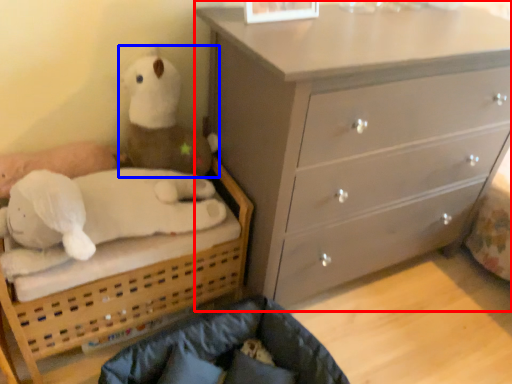
Question: Among these objects, which one is farthest to the camera, chest of drawers (highlighted by a red box) or toy (highlighted by a blue box)?

Choices:
 (A) chest of drawers
 (B) toy

Answer: (B)